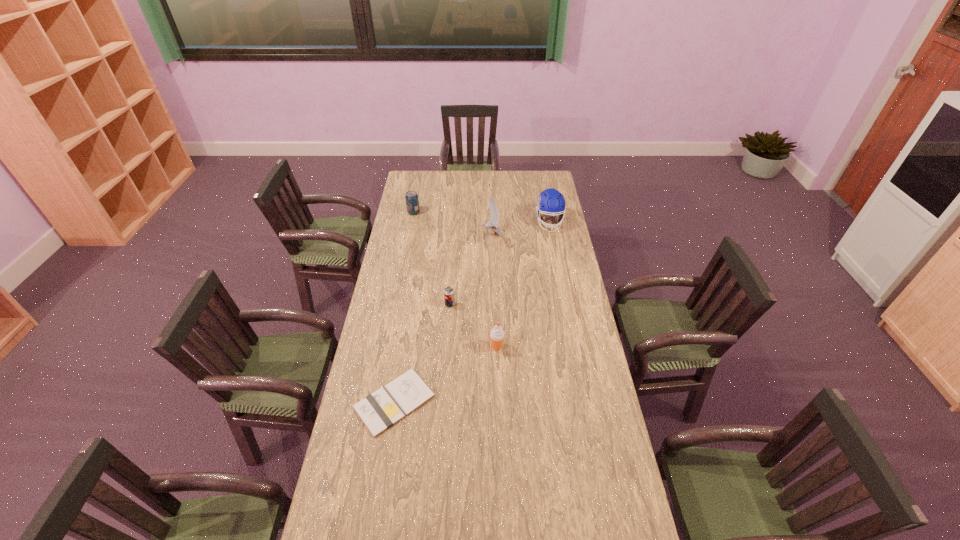
You are a GUI agent. You are given a task and a screenshot of the screen. Output one action in this format:
    pyautogui.click(x=<x>, y=<y>)
    Task: Click on the vacant position located at the tip of the beak of the gull
    The image size is (960, 540).
    Given the screenshot: What is the action you would take?
    pyautogui.click(x=465, y=235)

Find the location of a particular element. free region located at the tip of the beak of the gull is located at coordinates (420, 235).

Locate an element on the screen. This screenshot has width=960, height=540. vacant space located on the right of the fifth farthest object is located at coordinates (541, 347).

Image resolution: width=960 pixels, height=540 pixels. Find the location of `vacant position located 0.100m on the right of the pop soda`. vacant position located 0.100m on the right of the pop soda is located at coordinates (438, 212).

I want to click on vacant space situated 0.170m on the left of the second shortest object, so click(407, 305).

The width and height of the screenshot is (960, 540). In order to click on free location located 0.120m on the back of the shortest object in this screenshot , I will do `click(403, 346)`.

Locate an element on the screen. pop soda at the left edge is located at coordinates (412, 202).

Locate an element on the screen. Image resolution: width=960 pixels, height=540 pixels. notepad located in the left edge section of the desktop is located at coordinates (378, 411).

The height and width of the screenshot is (540, 960). I want to click on object present at the right edge, so click(x=550, y=201).

This screenshot has width=960, height=540. In the image, there is a desktop. Find the location of `free space at the far edge`. free space at the far edge is located at coordinates (433, 178).